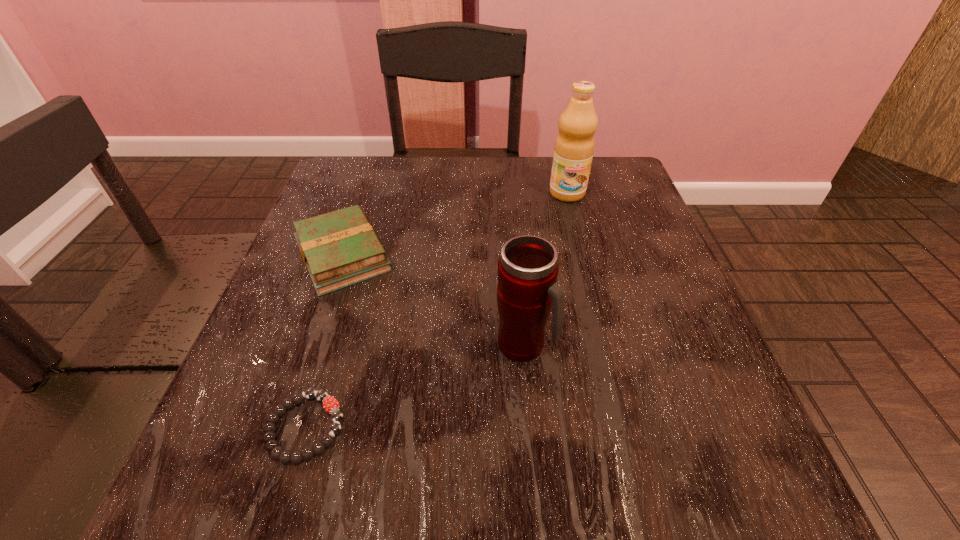
You are a GUI agent. You are given a task and a screenshot of the screen. Output one action in this format:
    pyautogui.click(x=<x>, y=<y>)
    Task: Click on the tallest object
    This screenshot has height=540, width=960.
    Given the screenshot: What is the action you would take?
    pyautogui.click(x=574, y=146)

In order to click on the farthest object in this screenshot , I will do `click(574, 146)`.

This screenshot has height=540, width=960. I want to click on the second nearest object, so click(x=527, y=271).

Identify the location of the second object from right to left. (527, 271).

The height and width of the screenshot is (540, 960). In order to click on the second farthest object in this screenshot , I will do `click(340, 248)`.

Image resolution: width=960 pixels, height=540 pixels. I want to click on the third tallest object, so click(x=340, y=248).

At what (x,y) coordinates should I click in order to perform the action: click on the shortest object. Please return your answer as a coordinate pair (x, y). This screenshot has width=960, height=540. Looking at the image, I should click on (330, 404).

Where is `the nearest object`? This screenshot has height=540, width=960. the nearest object is located at coordinates (330, 404).

At what (x,y) coordinates should I click in order to perform the action: click on free region located 0.340m on the label of the olive oil. Please return your answer as a coordinate pair (x, y). The height and width of the screenshot is (540, 960). Looking at the image, I should click on (598, 316).

What are the coordinates of `vacant space located on the side with the handle of the second tallest object` in the screenshot? It's located at (682, 345).